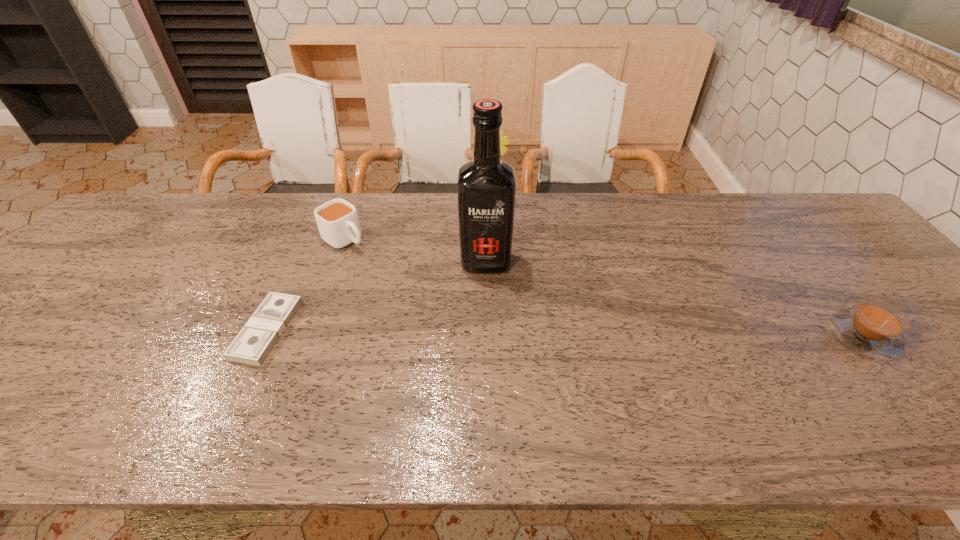
You are a GUI agent. You are given a task and a screenshot of the screen. Output one action in this format:
    pyautogui.click(x=<x>, y=<y>)
    Task: Click on the unoccupied position between the cup and the tallest object
    The height and width of the screenshot is (540, 960).
    Given the screenshot: What is the action you would take?
    pyautogui.click(x=416, y=251)

The height and width of the screenshot is (540, 960). Find the location of `free space between the sunflower and the cup`. free space between the sunflower and the cup is located at coordinates (419, 221).

This screenshot has width=960, height=540. Find the location of `free area in between the dollar and the tallest object`. free area in between the dollar and the tallest object is located at coordinates (376, 295).

You are a GUI agent. You are given a task and a screenshot of the screen. Output one action in this format:
    pyautogui.click(x=<x>, y=<y>)
    Task: Click on the free spot between the shortest object and the second tallest object
    The width and height of the screenshot is (960, 540).
    Given the screenshot: What is the action you would take?
    pyautogui.click(x=379, y=266)

Where is `the fourth closest object to the third shortest object`? This screenshot has height=540, width=960. the fourth closest object to the third shortest object is located at coordinates (873, 328).

The height and width of the screenshot is (540, 960). What are the coordinates of `the third closest object to the tallest object` in the screenshot? It's located at (254, 342).

Where is `vacant point that satisfies the following two spatial constraints: 1. on the front side of the tallest object; 2. on the right side of the third tallest object`? vacant point that satisfies the following two spatial constraints: 1. on the front side of the tallest object; 2. on the right side of the third tallest object is located at coordinates (337, 262).

Identify the location of vacant region that satisfies the following two spatial constraints: 1. on the back side of the cup; 2. on the left side of the sunflower. This screenshot has height=540, width=960. (357, 203).

The image size is (960, 540). Find the location of `free location that satisfies the following two spatial constraints: 1. on the front side of the cappuccino; 2. on the left side of the cup`. free location that satisfies the following two spatial constraints: 1. on the front side of the cappuccino; 2. on the left side of the cup is located at coordinates (311, 337).

Identify the location of vacant space that satisfies the following two spatial constraints: 1. on the front side of the rightmost object; 2. on the right side of the dollar. (264, 337).